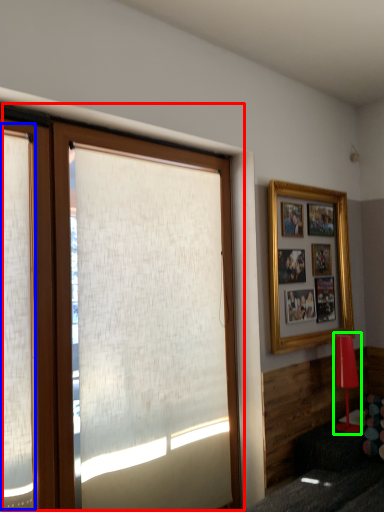
Question: Based on their relative distances, which object is farther from window (highlighted by a red box)? Choose from shutter (highlighted by a blue box) and lamp (highlighted by a green box).

Choices:
 (A) shutter
 (B) lamp

Answer: (B)